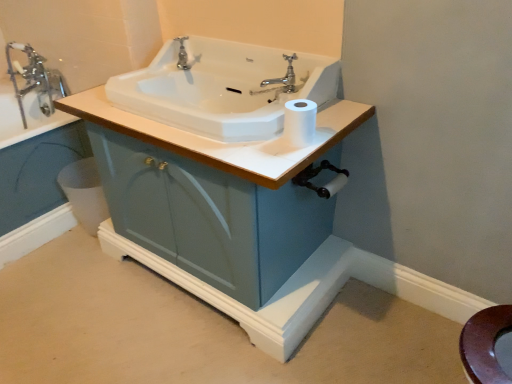
The height and width of the screenshot is (384, 512). I want to click on free space to the left of white glossy bidet at lower left, so click(60, 237).